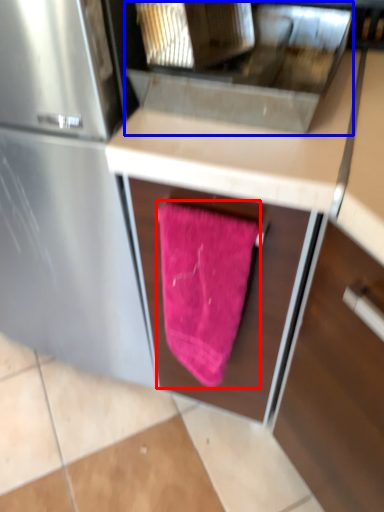
Question: Among these objects, which one is farthest to the camera, beach towel (highlighted by a red box) or sink (highlighted by a blue box)?

Choices:
 (A) beach towel
 (B) sink

Answer: (A)